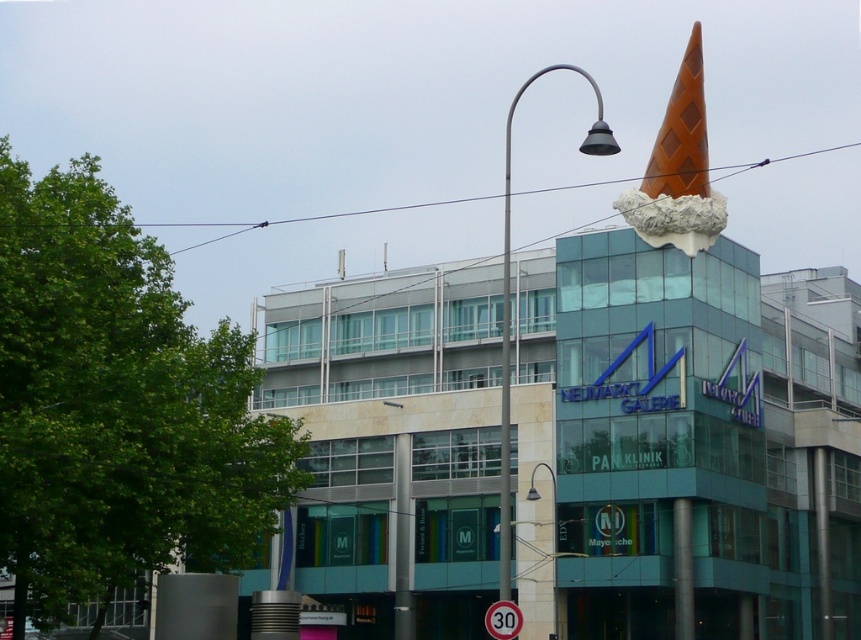
Is orange diamond-patterned ice cream cone at upper center below metallic gray streetlamp at upper center?

Incorrect, orange diamond-patterned ice cream cone at upper center is not positioned below metallic gray streetlamp at upper center.

Who is higher up, orange diamond-patterned ice cream cone at upper center or metallic gray streetlamp at upper center?

orange diamond-patterned ice cream cone at upper center is above.

Where is `orange diamond-patterned ice cream cone at upper center`? orange diamond-patterned ice cream cone at upper center is located at coordinates (678, 170).